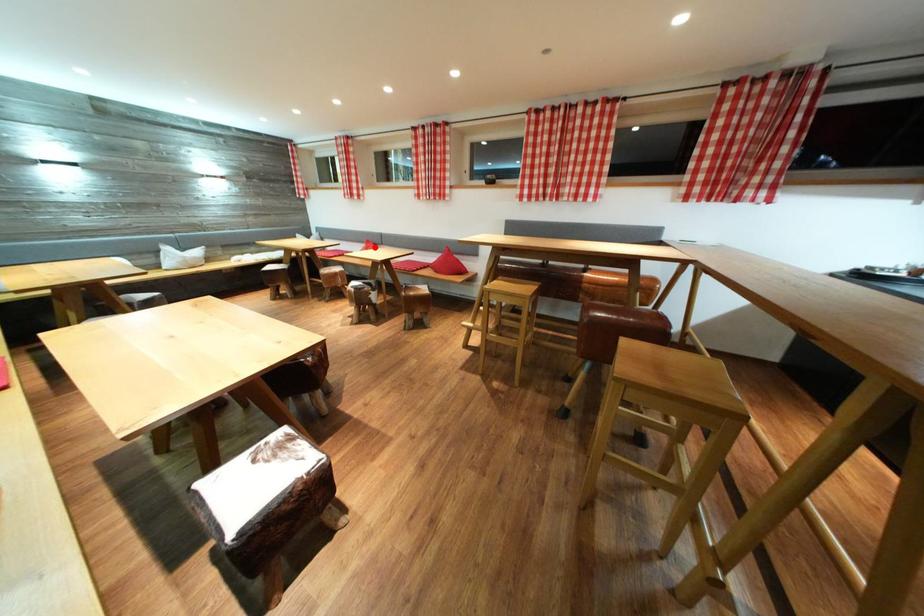
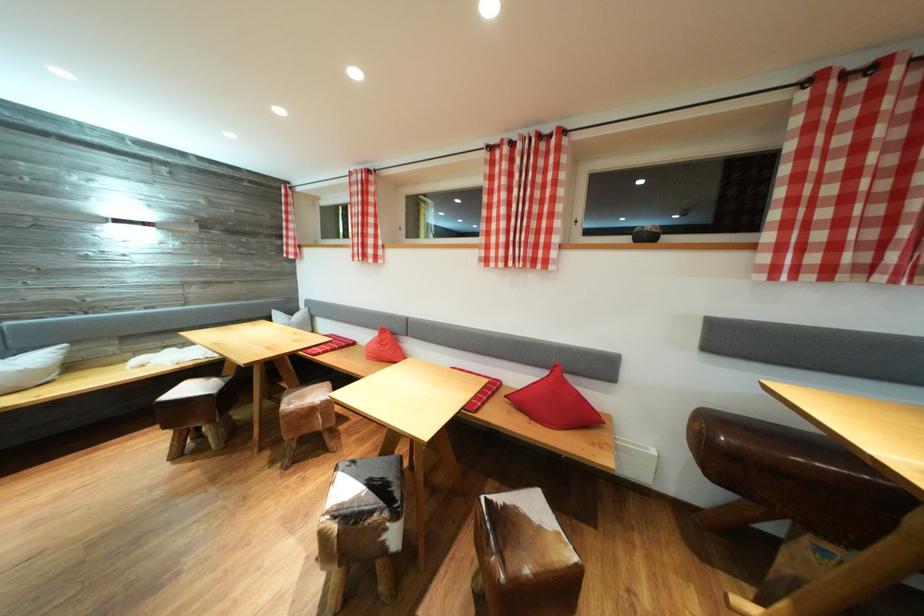
Where in the second image is the point corresponding to the highlighted location from the first image?

(390, 336)